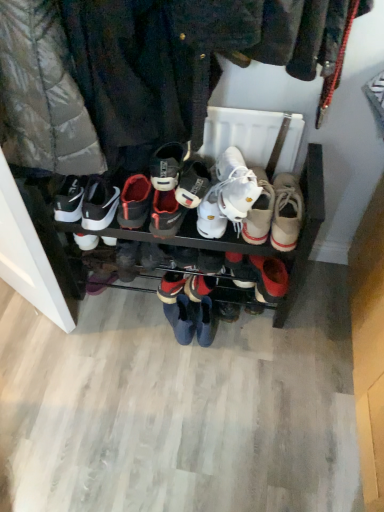
You are a GUI agent. You are given a task and a screenshot of the screen. Output one action in this format:
    pyautogui.click(x=<x>, y=<y>)
    Task: Click on the vacant area that is in front of white leather sneakers at center, positioned as the 5th footwear in left-to-right order
    This screenshot has width=384, height=512.
    Given the screenshot: What is the action you would take?
    pyautogui.click(x=180, y=406)